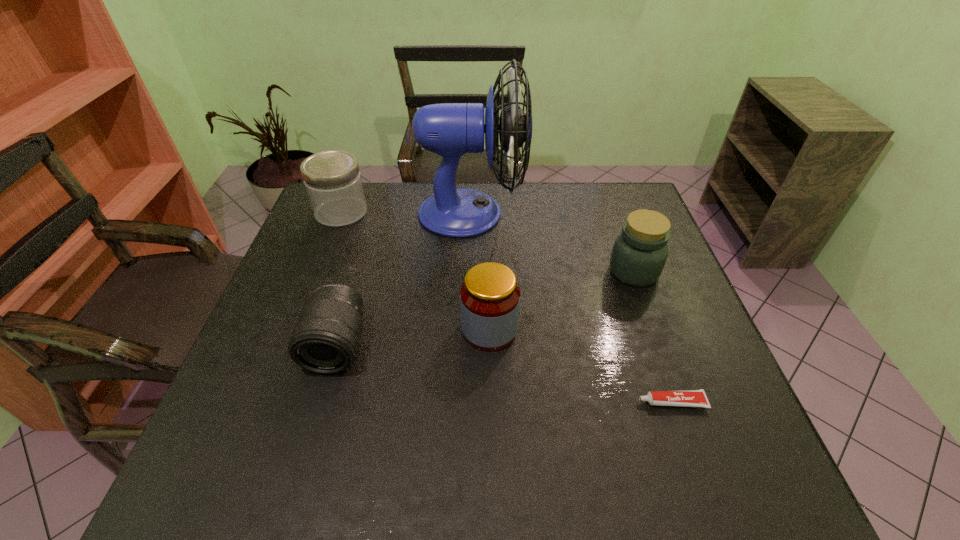
I want to click on jar that can be found as the second closest to the tallest object, so click(x=639, y=253).

Locate an element on the screen. free region that satisfies the following two spatial constraints: 1. on the front side of the second jar from left to right; 2. on the left side of the leftmost jar is located at coordinates (297, 329).

The height and width of the screenshot is (540, 960). In order to click on free space that satisfies the following two spatial constraints: 1. on the front side of the leftmost jar; 2. on the left side of the second jar from right to left in this screenshot , I will do `click(297, 329)`.

This screenshot has width=960, height=540. In order to click on vacant region that satisfies the following two spatial constraints: 1. on the front side of the rightmost jar; 2. at the nozzle of the nearest object in this screenshot , I will do `click(681, 402)`.

Find the location of a particular element. Image resolution: width=960 pixels, height=540 pixels. free location that satisfies the following two spatial constraints: 1. in front of the fan where the airflow is directed; 2. on the back side of the nearest jar is located at coordinates (468, 329).

Where is `vacant space that satisfies the following two spatial constraints: 1. in front of the second nearest jar where the airflow is directed; 2. on the right side of the tallest object`? The image size is (960, 540). vacant space that satisfies the following two spatial constraints: 1. in front of the second nearest jar where the airflow is directed; 2. on the right side of the tallest object is located at coordinates (469, 272).